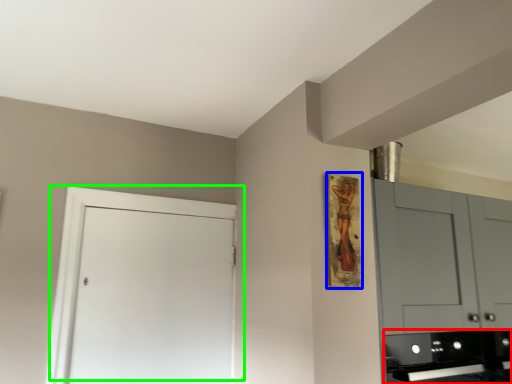
Question: Considering the real-world distances, which object is closest to appliance (highlighted by a red box)? picture frame (highlighted by a blue box) or door (highlighted by a green box).

Choices:
 (A) picture frame
 (B) door

Answer: (A)